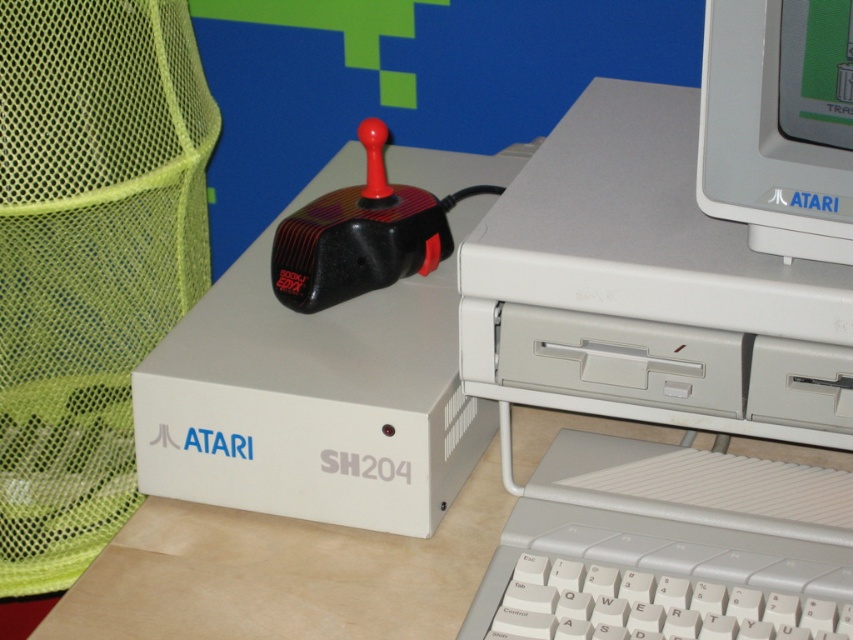
Between point (821, 348) and point (786, 124), which one is positioned behind?

Positioned behind is point (821, 348).

Is white plastic computer at center taller than matte plastic monitor at upper right?

Yes, white plastic computer at center is taller than matte plastic monitor at upper right.

Is point (543, 376) behind point (769, 108)?

Yes.

Identify the location of white plastic computer at center. The image size is (853, 640). [653, 387].